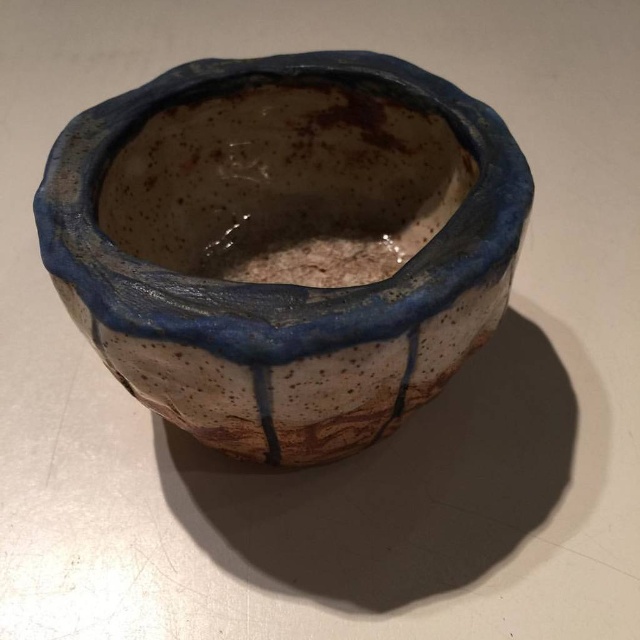
Is point (148, 120) closer to camera compared to point (308, 125)?

Yes, point (148, 120) is in front of point (308, 125).

Between speckled ceramic pot at center and speckled clay pot at center, which one is positioned higher?

speckled clay pot at center is above.

Is point (192, 224) positioned after point (305, 280)?

No, (192, 224) is in front of (305, 280).

Identify the location of speckled ceramic pot at center. (282, 241).